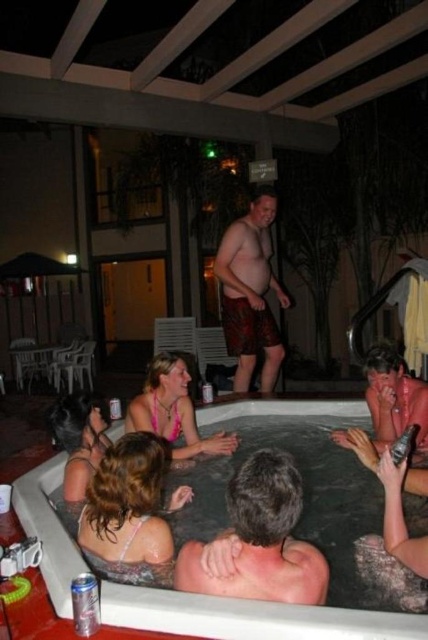
Between white plastic hot tub at lower center and dark brown hair at back, which one appears on the right side from the viewer's perspective?

dark brown hair at back is more to the right.

Can you confirm if white plastic hot tub at lower center is thinner than dark brown hair at back?

No.

Between point (262, 630) and point (249, 593), which one is positioned behind?

The point (249, 593) is more distant.

This screenshot has width=428, height=640. What are the coordinates of `white plastic hot tub at lower center` in the screenshot? It's located at pyautogui.click(x=249, y=618).

Does dark brown hair at back appear on the left side of silver metallic can at lower left?

In fact, dark brown hair at back is to the right of silver metallic can at lower left.

Is dark brown hair at back positioned behind silver metallic can at lower left?

No, it is not.

Is point (318, 600) positioned after point (83, 618)?

No, it is not.

Locate an element on the screen. The width and height of the screenshot is (428, 640). dark brown hair at back is located at coordinates (258, 540).

Is dark brown hair at back bigger than printed fabric shorts at center?

No.

Between point (219, 547) and point (264, 225), which one is positioned in front?

Point (219, 547) is more forward.

Is point (252, 588) closer to viewer compared to point (222, 284)?

Yes.

Where is `dark brown hair at back`? dark brown hair at back is located at coordinates (258, 540).